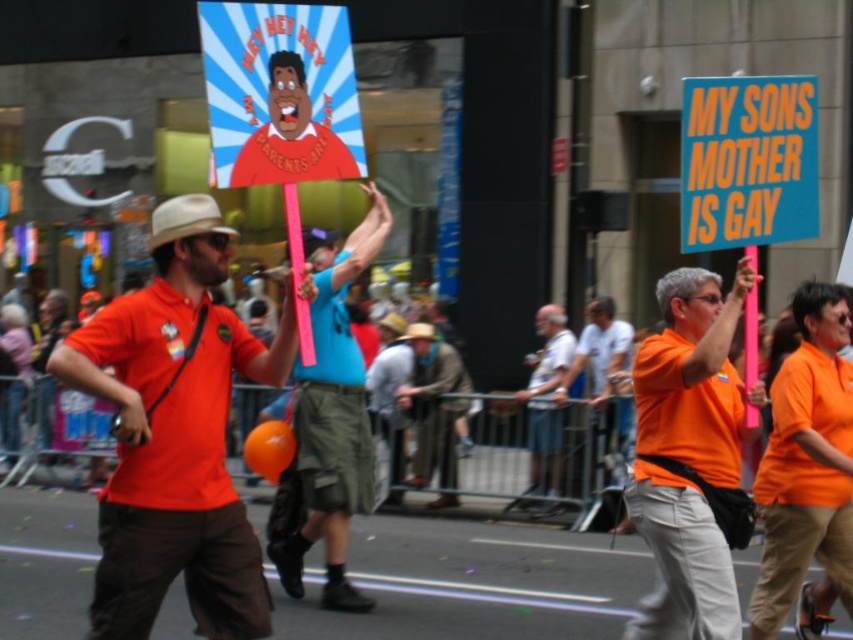
Can you confirm if matte orange shirt at center is shorter than orange matte shirt at center?

Yes, matte orange shirt at center is shorter than orange matte shirt at center.

Who is more forward, (167,211) or (715,292)?

Point (167,211)

This screenshot has height=640, width=853. In order to click on matte orange shirt at center in this screenshot , I will do `click(175, 435)`.

Can you confirm if blue cotton shirt at center is thinner than brown leather jacket at center?

A: In fact, blue cotton shirt at center might be wider than brown leather jacket at center.

What do you see at coordinates (329, 419) in the screenshot? I see `blue cotton shirt at center` at bounding box center [329, 419].

Locate an element on the screen. The width and height of the screenshot is (853, 640). blue cotton shirt at center is located at coordinates (329, 419).

Between orange matte shirt at center and blue cotton shirt at center, which one has more height?

With more height is blue cotton shirt at center.

Does orange matte shirt at center have a lesser height compared to blue cotton shirt at center?

Yes.

Describe the element at coordinates (688, 454) in the screenshot. I see `orange matte shirt at center` at that location.

Find the location of a particular element. orange matte shirt at center is located at coordinates point(688,454).